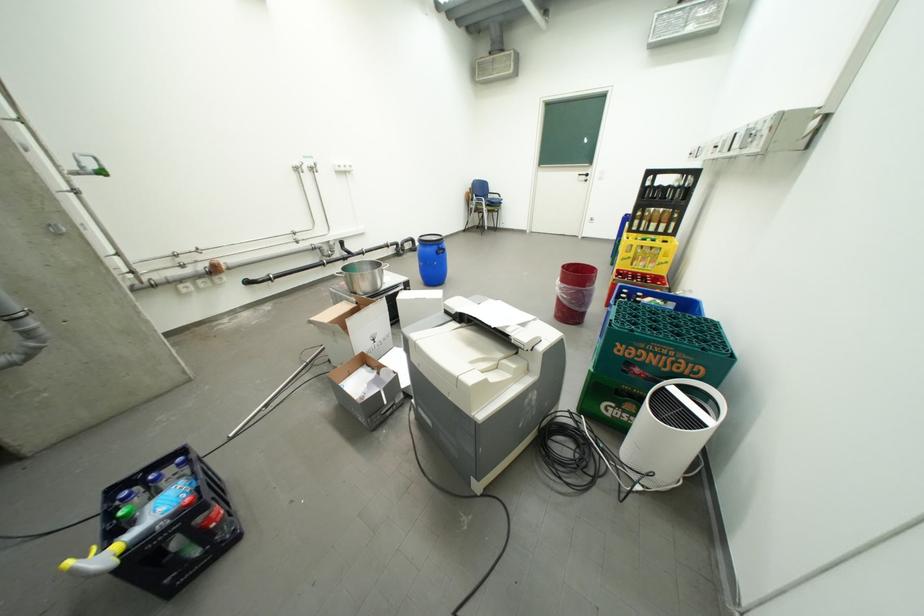
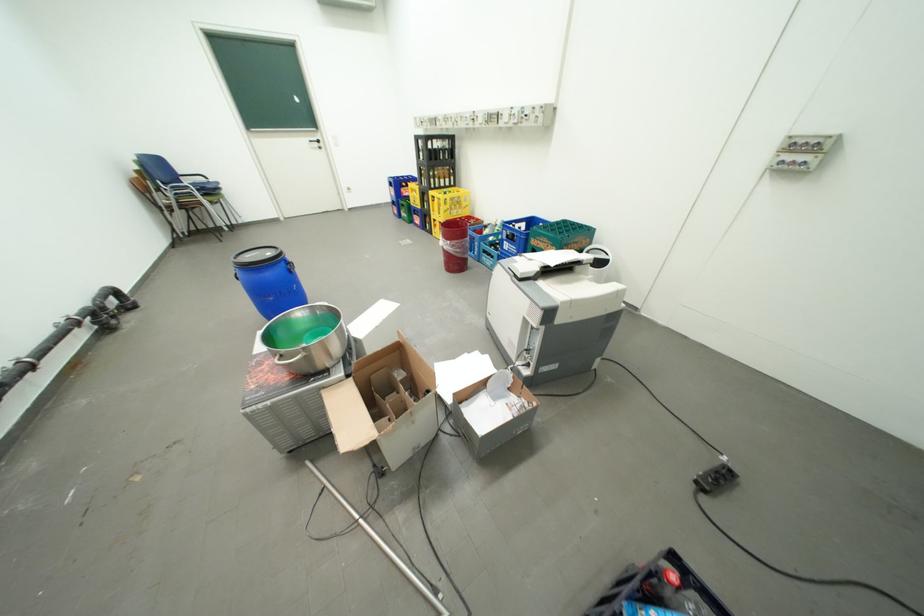
Find the pixel in the second image that matches point 444,246 in the first image.

(290, 262)